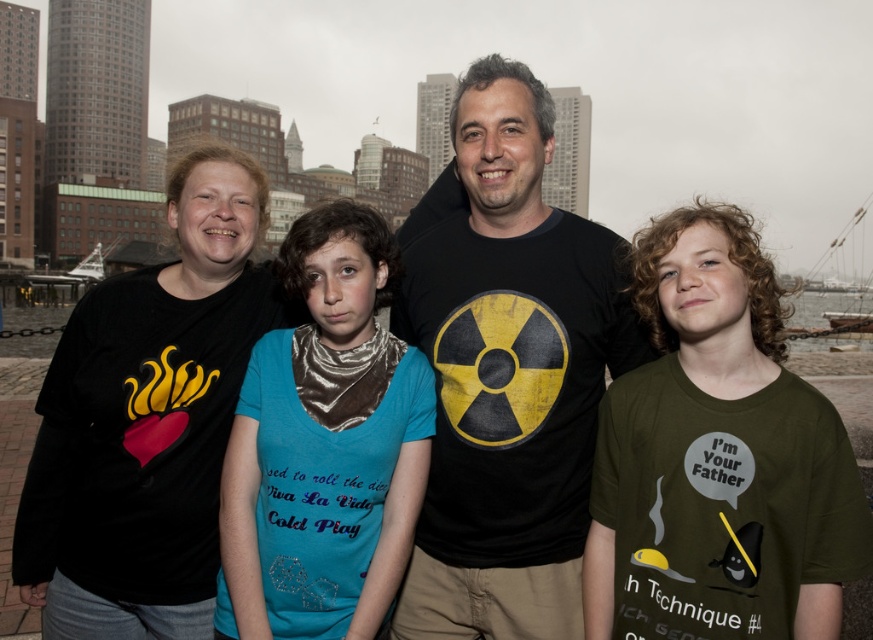
Question: Which of these objects is positioned farthest from the black distressed t-shirt at center?

Choices:
 (A) black matte heart at left
 (B) olive green t-shirt at center

Answer: (A)

Question: Can you confirm if black distressed t-shirt at center is thinner than olive green t-shirt at center?

Choices:
 (A) no
 (B) yes

Answer: (A)

Question: Which point is farther to the camera?

Choices:
 (A) (136, 595)
 (B) (354, 396)
 (C) (581, 372)
 (D) (775, 499)

Answer: (C)

Question: Which object is the farthest from the olive green t-shirt at center?

Choices:
 (A) teal fabric shirt at center
 (B) black distressed t-shirt at center

Answer: (A)

Question: Does olive green t-shirt at center have a smaller size compared to teal fabric shirt at center?

Choices:
 (A) yes
 (B) no

Answer: (B)

Question: Does olive green t-shirt at center appear over teal fabric shirt at center?

Choices:
 (A) no
 (B) yes

Answer: (A)